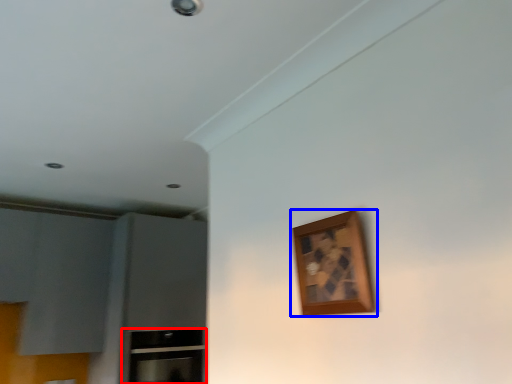
Question: Among these objects, which one is nearest to the camera, cabinetry (highlighted by a red box) or picture frame (highlighted by a blue box)?

Choices:
 (A) cabinetry
 (B) picture frame

Answer: (B)